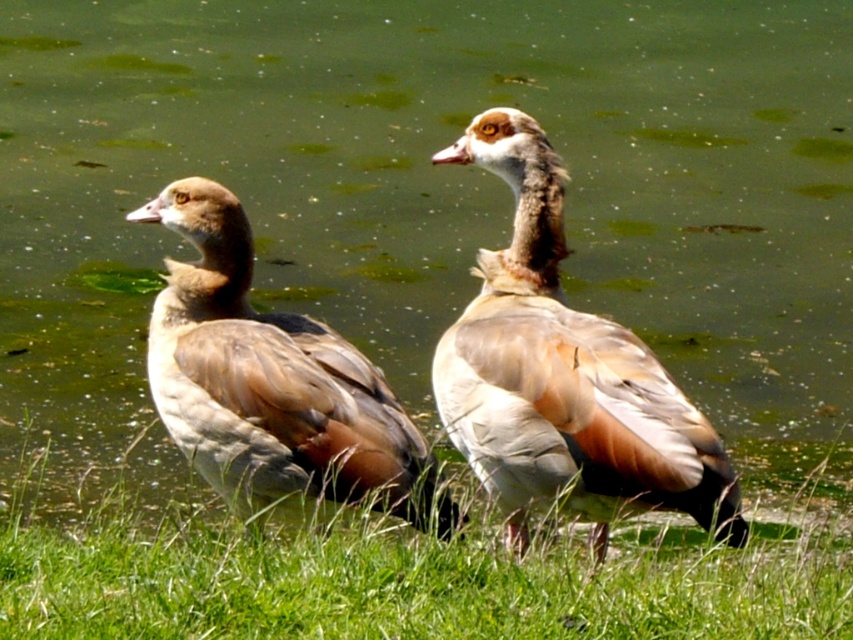
Does brown feathered duck at center lie behind brown feathered duck at left?

No, it is in front of brown feathered duck at left.

Is brown feathered duck at center bigger than brown feathered duck at left?

Correct, brown feathered duck at center is larger in size than brown feathered duck at left.

Is point (532, 378) positioned before point (285, 369)?

Yes.

Image resolution: width=853 pixels, height=640 pixels. I want to click on brown feathered duck at center, so [563, 372].

Is green grass at lower center above brown feathered duck at left?

No, green grass at lower center is not above brown feathered duck at left.

Describe the element at coordinates (410, 580) in the screenshot. Image resolution: width=853 pixels, height=640 pixels. I see `green grass at lower center` at that location.

Which is in front, point (274, 529) or point (260, 422)?

Point (260, 422) is more forward.

At what (x,y) coordinates should I click in order to perform the action: click on green grass at lower center. Please return your answer as a coordinate pair (x, y). This screenshot has width=853, height=640. Looking at the image, I should click on (410, 580).

Between green grass at lower center and brown feathered duck at center, which one has less height?

With less height is green grass at lower center.

Can you confirm if green grass at lower center is positioned to the left of brown feathered duck at center?

Incorrect, green grass at lower center is not on the left side of brown feathered duck at center.

Is point (35, 602) closer to viewer compared to point (711, 444)?

Yes, point (35, 602) is in front of point (711, 444).

This screenshot has height=640, width=853. I want to click on green grass at lower center, so click(x=410, y=580).